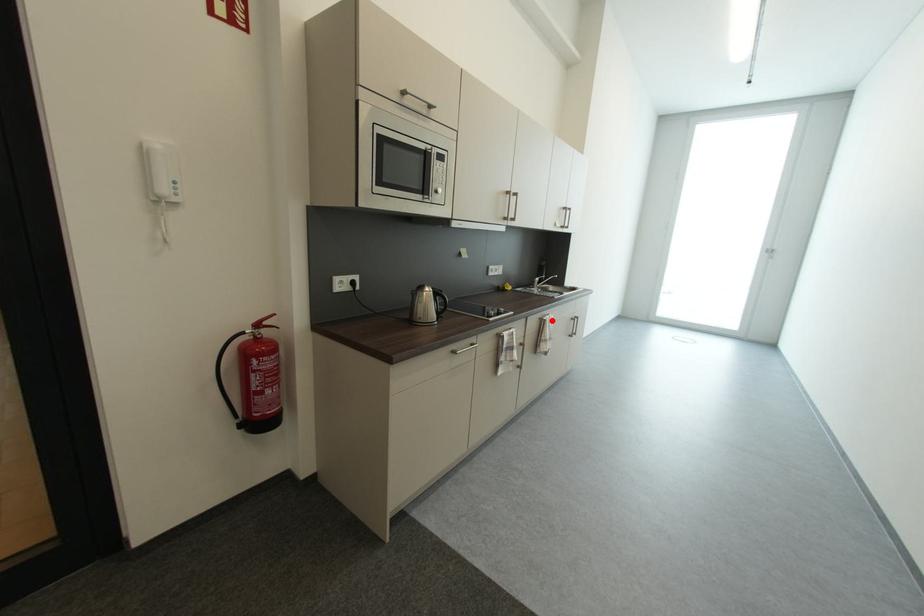
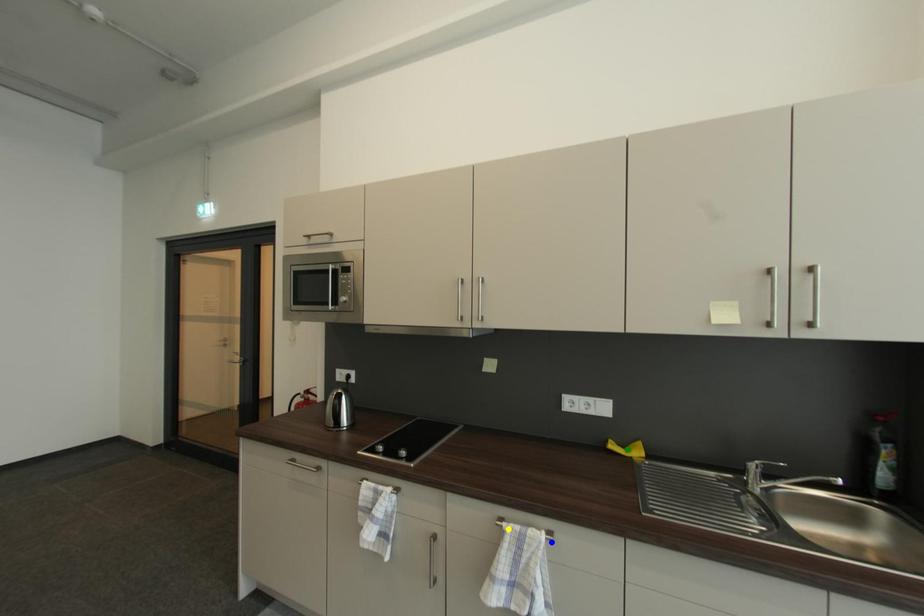
Question: I am providing you with two images of the same scene from different viewpoints. A red point is marked on the first image. You are given multiple points on the second image. Can you choose the point in image 2 that corresponds to the point in image 1?

Choices:
 (A) green point
 (B) blue point
 (C) yellow point

Answer: (C)